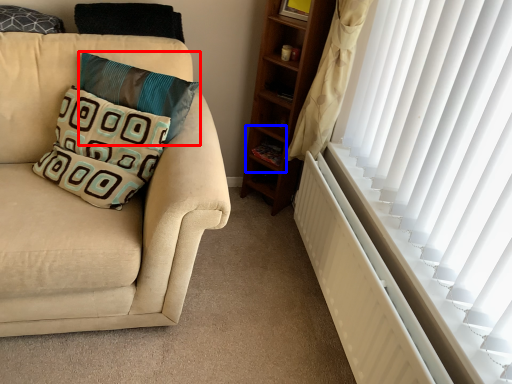
Question: Among these objects, which one is nearest to the camera, pillow (highlighted by a red box) or shelf (highlighted by a blue box)?

Choices:
 (A) pillow
 (B) shelf

Answer: (A)